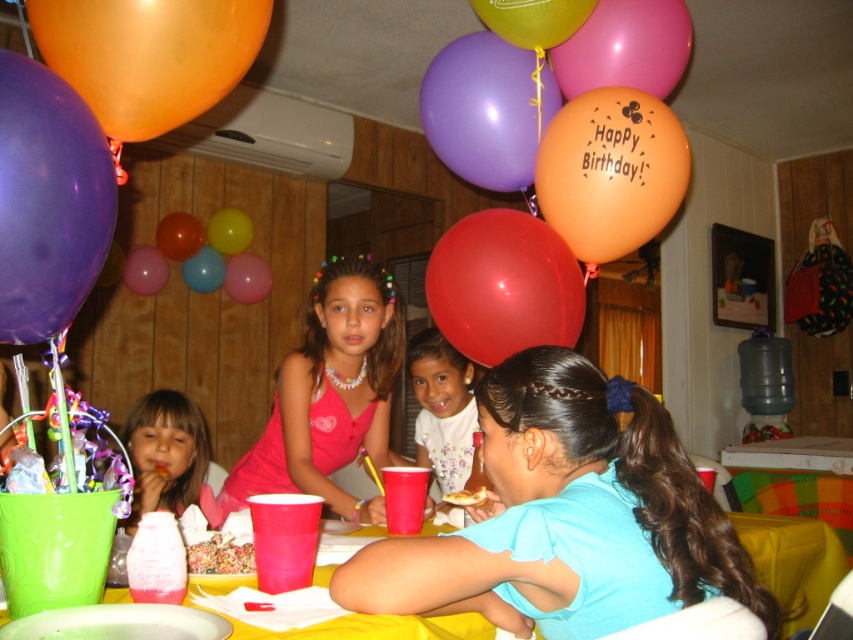
Is point (370, 401) behind point (650, 1)?

Yes, it is behind point (650, 1).

Between pink satin dress at center and orange matte balloon at upper right, which one appears on the right side from the viewer's perspective?

Positioned to the right is orange matte balloon at upper right.

Where is `pink satin dress at center`? This screenshot has width=853, height=640. pink satin dress at center is located at coordinates (329, 394).

The height and width of the screenshot is (640, 853). Describe the element at coordinates (48, 200) in the screenshot. I see `purple rubber balloon at upper left` at that location.

Measure the distance between purple rubber balloon at upper left and orange matte balloon at upper left.

A distance of 7.70 inches exists between purple rubber balloon at upper left and orange matte balloon at upper left.

Which is in front, point (90, 273) or point (115, 32)?

Positioned in front is point (90, 273).

I want to click on purple rubber balloon at upper left, so click(x=48, y=200).

Can you confirm if purple rubber balloon at upper left is positioned to the left of purple matte balloon at upper center?

Yes, purple rubber balloon at upper left is to the left of purple matte balloon at upper center.

Can you confirm if purple rubber balloon at upper left is taller than purple matte balloon at upper center?

Incorrect, purple rubber balloon at upper left's height is not larger of purple matte balloon at upper center's.

The image size is (853, 640). What are the coordinates of `purple rubber balloon at upper left` in the screenshot? It's located at (48, 200).